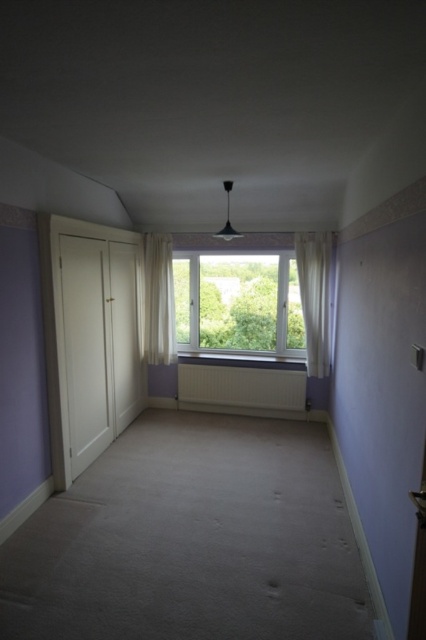
You are standing in the room and want to determine the relative positions of two points marked in the scene. Which point is closer to you, the point at coordinates point [279,387] or the point at coordinates point [327,244]?

The point at coordinates point [279,387] is further to the viewer than point [327,244], so the point at coordinates point [327,244] is closer to you.

You are standing in the middle of the room and want to walk towards the white plastic window at center. In which direction should you move?

Since the white plastic window at center is located at point coordinates of 0.473 on the x axis and 0.561 on the y axis, you should move forward and slightly to the right to reach it.

You are an interior designer planning to install a new decorative element between the white plastic window at center and the white sheer curtain at center. Since the window is wider than the curtain, which object should the decorative element be placed closer to to ensure it aligns with the wider space?

Answer: The decorative element should be placed closer to the white plastic window at center because its width is larger than the white sheer curtain at center, providing more space for alignment.